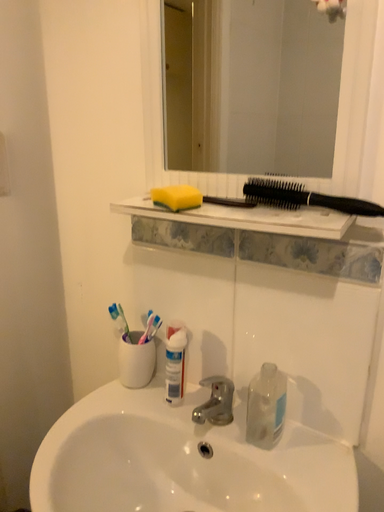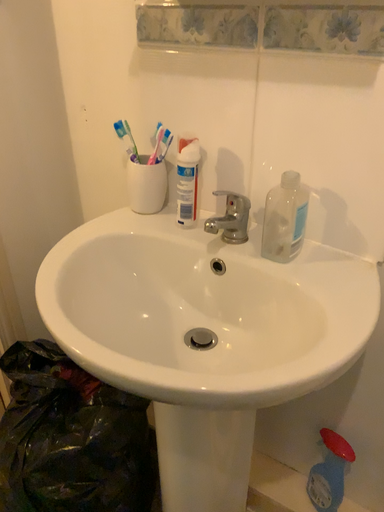
Question: How did the camera likely rotate when shooting the video?

Choices:
 (A) rotated upward
 (B) rotated downward

Answer: (B)